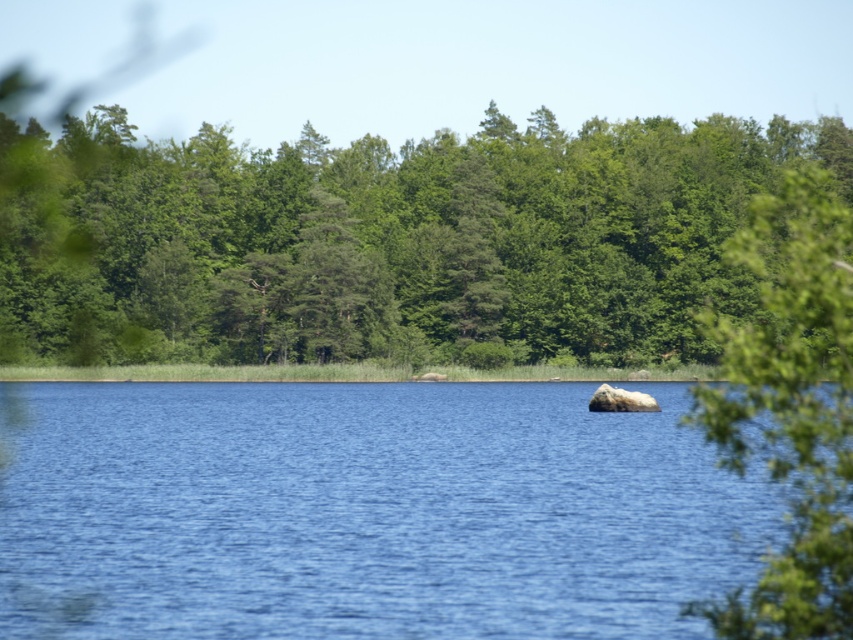
Question: Does green leafy trees at center have a larger size compared to green leafy tree at upper right?

Choices:
 (A) no
 (B) yes

Answer: (B)

Question: Considering the real-world distances, which object is farthest from the green leafy tree at upper right?

Choices:
 (A) green leafy trees at center
 (B) blue water at center

Answer: (A)

Question: Is blue water at center positioned behind green leafy tree at upper right?

Choices:
 (A) yes
 (B) no

Answer: (A)

Question: Is blue water at center behind green leafy tree at upper right?

Choices:
 (A) no
 (B) yes

Answer: (B)

Question: Estimate the real-world distances between objects in this image. Which object is farther from the blue water at center?

Choices:
 (A) green leafy trees at center
 (B) green leafy tree at upper right

Answer: (A)

Question: Among these objects, which one is nearest to the camera?

Choices:
 (A) green leafy tree at upper right
 (B) blue water at center
 (C) green leafy trees at center

Answer: (A)